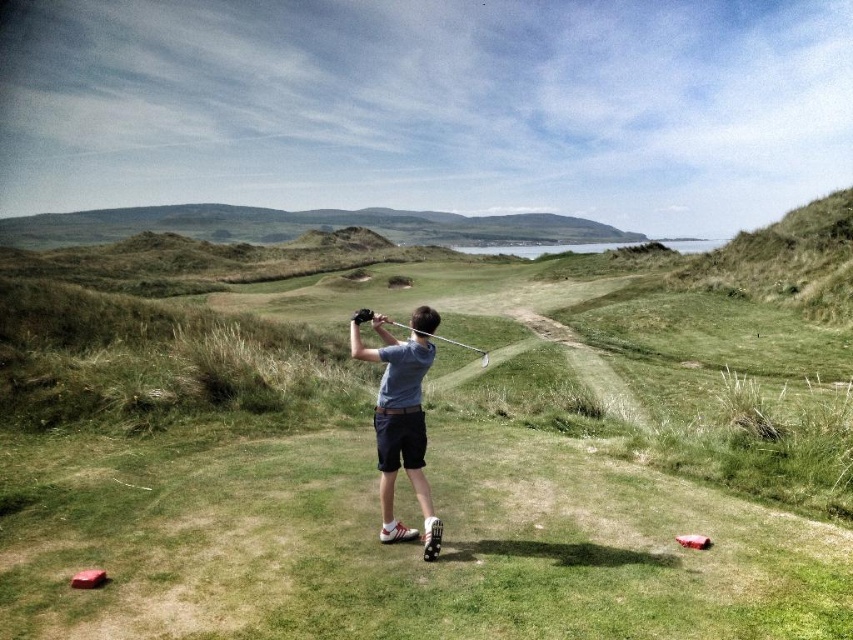
You are a photographer positioned at the camera. You want to capture a closeup shot of the gray cotton shirt at center. Given that your camera can focus on objects within 15 feet, will you be able to achieve a clear closeup?

The gray cotton shirt at center is 18.36 feet away from the camera, which is beyond the 15 feet focusing range. Therefore, you cannot achieve a clear closeup with the current distance.

You are a photographer standing on the golf course. You want to take a photo of the gray cotton shirt at center and the metallic silver golf club at center. Which object should you focus on first if you want to capture both in the same frame without moving the camera?

The gray cotton shirt at center is much taller than the metallic silver golf club at center, so you should focus on the gray cotton shirt at center first to ensure both are in focus.